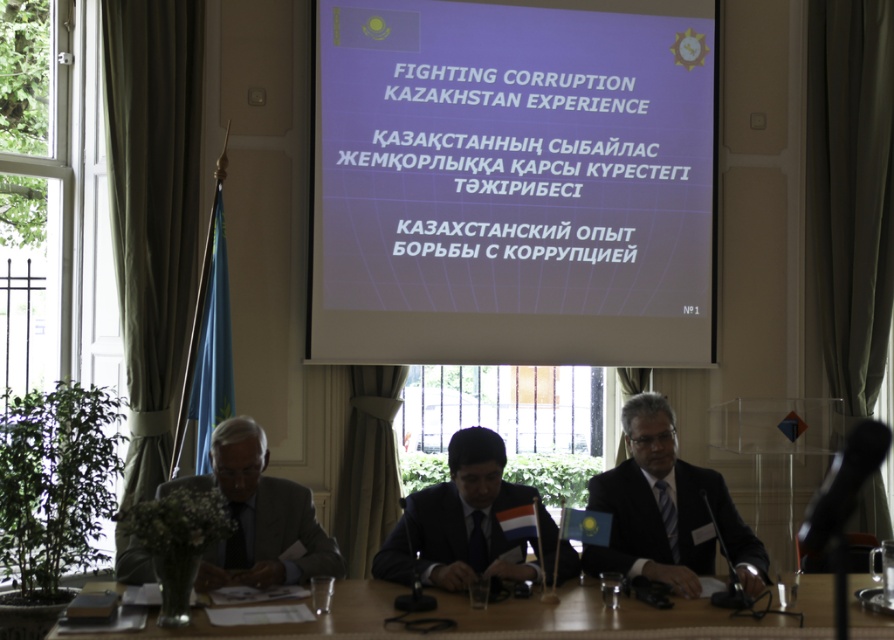
From the picture: You are standing in the conference room and want to place a 3.0 meter long banner on the floor in front of the wooden table at center. Can you fit it there?

The wooden table at center is 3.10 meters away from the viewer. Since the banner is 3.0 meters long, it will fit in front of the wooden table at center as there is enough space.

You are organizing a presentation and need to place a 1.2 meter wide banner between the white glossy projection screen at center and the wooden table at center. Based on their widths, will the banner fit between them?

The white glossy projection screen at center is thinner than the wooden table at center. Since the banner is 1.2 meters wide and the screen is thinner than the table, the total space between them may vary. However, without knowing the exact width of the table or screen, it is impossible to determine if the banner will fit. Please provide more information about the dimensions of the table or screen.